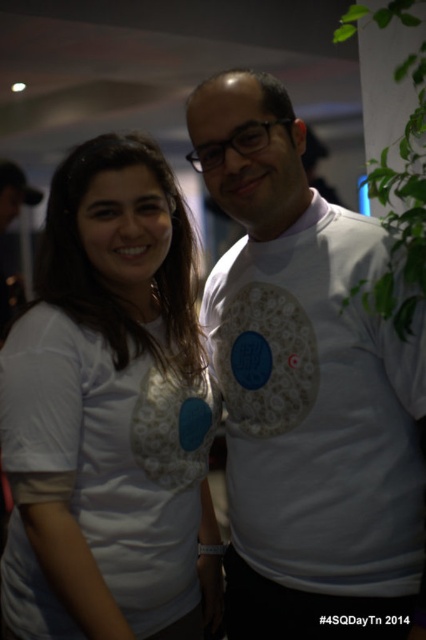
Question: Is white matte t-shirt at center closer to camera compared to green leafy plant at upper right?

Choices:
 (A) yes
 (B) no

Answer: (B)

Question: Is white matte t-shirt at center further to the viewer compared to white lace shirt at left?

Choices:
 (A) yes
 (B) no

Answer: (A)

Question: Which of the following is the farthest from the observer?

Choices:
 (A) green leafy plant at upper right
 (B) white matte t-shirt at center
 (C) white lace shirt at left

Answer: (B)

Question: Observing the image, what is the correct spatial positioning of white matte t-shirt at center in reference to white lace shirt at left?

Choices:
 (A) above
 (B) below

Answer: (A)

Question: Which point appears farthest from the camera in this image?

Choices:
 (A) pyautogui.click(x=152, y=628)
 (B) pyautogui.click(x=210, y=131)

Answer: (A)

Question: Which is nearer to the white lace shirt at left?

Choices:
 (A) white matte t-shirt at center
 (B) green leafy plant at upper right

Answer: (A)